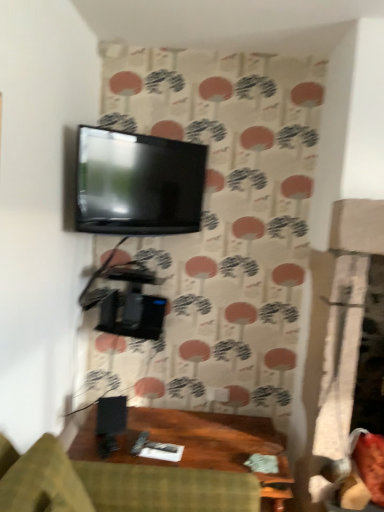
Question: From the image's perspective, is black matte speaker at lower center on green fabric studio couch at lower center?

Choices:
 (A) no
 (B) yes

Answer: (B)

Question: Is black matte speaker at lower center thinner than green fabric studio couch at lower center?

Choices:
 (A) yes
 (B) no

Answer: (A)

Question: Does black matte speaker at lower center have a greater width compared to green fabric studio couch at lower center?

Choices:
 (A) yes
 (B) no

Answer: (B)

Question: From the image's perspective, is black matte speaker at lower center below green fabric studio couch at lower center?

Choices:
 (A) yes
 (B) no

Answer: (B)

Question: Is the position of black matte speaker at lower center less distant than that of green fabric studio couch at lower center?

Choices:
 (A) yes
 (B) no

Answer: (B)

Question: From the image's perspective, is green fabric studio couch at lower center located above or below black matte speaker at lower center?

Choices:
 (A) below
 (B) above

Answer: (A)

Question: In terms of height, does green fabric studio couch at lower center look taller or shorter compared to black matte speaker at lower center?

Choices:
 (A) short
 (B) tall

Answer: (B)

Question: In terms of size, does green fabric studio couch at lower center appear bigger or smaller than black matte speaker at lower center?

Choices:
 (A) small
 (B) big

Answer: (B)

Question: Considering the positions of green fabric studio couch at lower center and black matte speaker at lower center in the image, is green fabric studio couch at lower center wider or thinner than black matte speaker at lower center?

Choices:
 (A) wide
 (B) thin

Answer: (A)

Question: From their relative heights in the image, would you say matte black tv at upper center is taller or shorter than green fabric studio couch at lower center?

Choices:
 (A) short
 (B) tall

Answer: (B)

Question: In the image, is matte black tv at upper center positioned in front of or behind green fabric studio couch at lower center?

Choices:
 (A) front
 (B) behind

Answer: (A)

Question: Is matte black tv at upper center wider or thinner than green fabric studio couch at lower center?

Choices:
 (A) wide
 (B) thin

Answer: (B)

Question: Would you say matte black tv at upper center is to the left or to the right of green fabric studio couch at lower center in the picture?

Choices:
 (A) left
 (B) right

Answer: (A)

Question: From the image's perspective, is green fabric studio couch at lower center above or below matte black tv at upper center?

Choices:
 (A) above
 (B) below

Answer: (B)

Question: Does point (36, 490) appear closer or farther from the camera than point (122, 153)?

Choices:
 (A) farther
 (B) closer

Answer: (B)